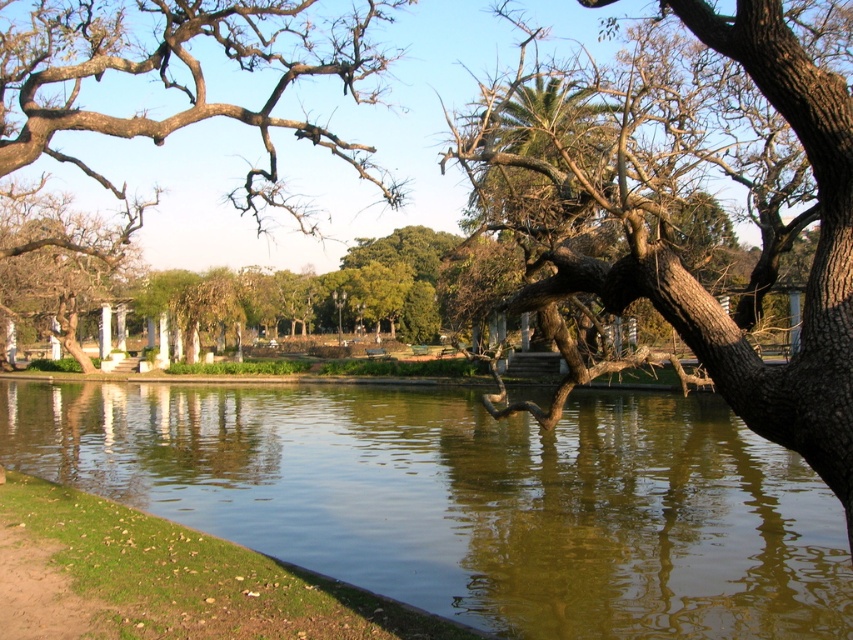
You are standing in the park and want to take a photo of the brown textured bark at center and the brown rough tree at upper left. Which object should you focus on first if you want to capture both in a single frame without moving the camera?

You should focus on the brown rough tree at upper left first because it is higher up in the frame than the brown textured bark at center, which is positioned below it.

Based on the photo, you are standing in the park and want to take a photo of both the brown textured bark at center and the brown wood tree at left. Which one should you adjust your camera angle to capture first if you want to include both in your shot?

The brown wood tree at left should be captured first since it is positioned to the left of the brown textured bark at center, allowing you to frame both by adjusting your angle from left to right.

You are standing in the park and want to reach the point marked at coordinates point (138, 465). If your walking speed is 1.5 meters per second, how many seconds will it take you to reach that point?

The distance between you and the point (138, 465) is 15.07 meters. At a walking speed of 1.5 meters per second, it will take approximately 10.05 seconds to reach the point.